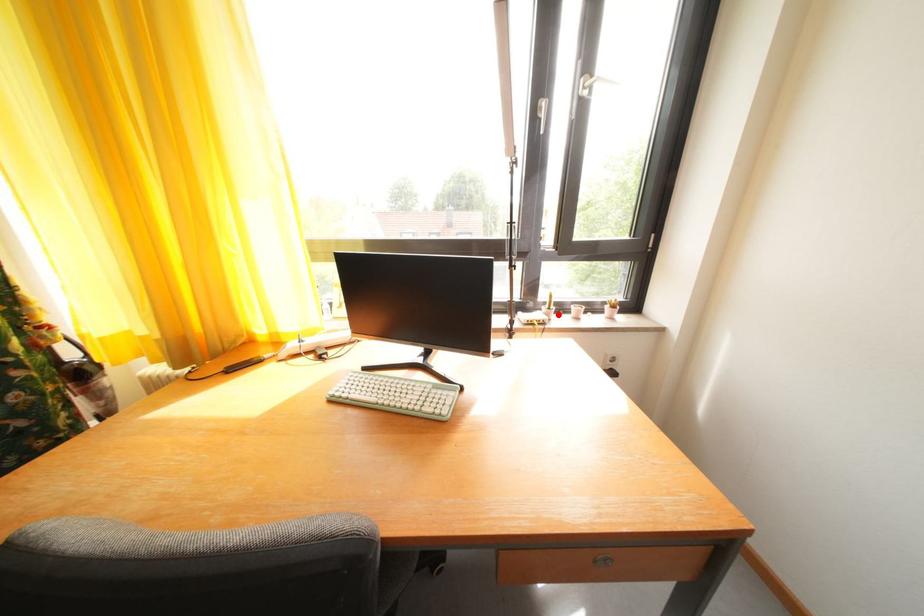
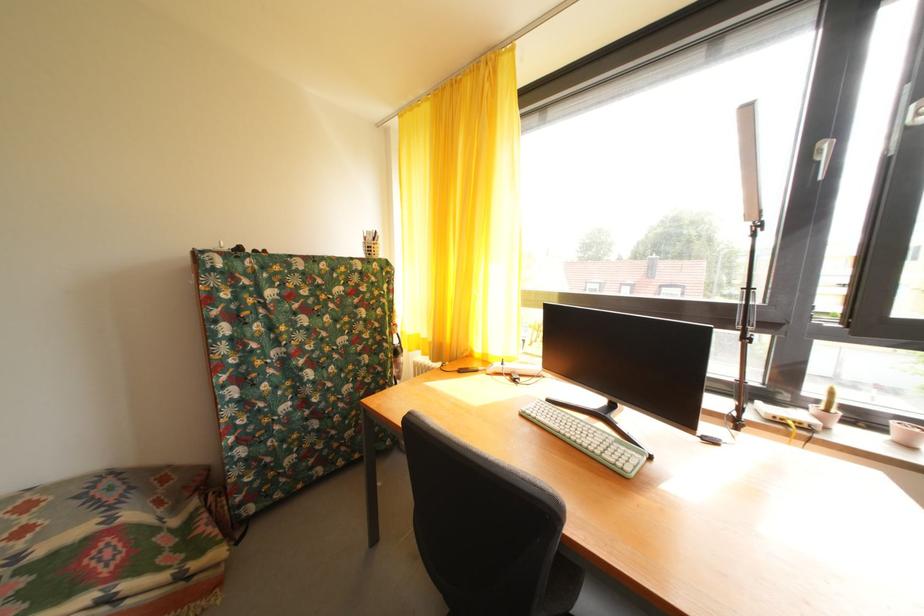
Find the pixel in the second image that matches the highlighted location in the first image.

(836, 416)